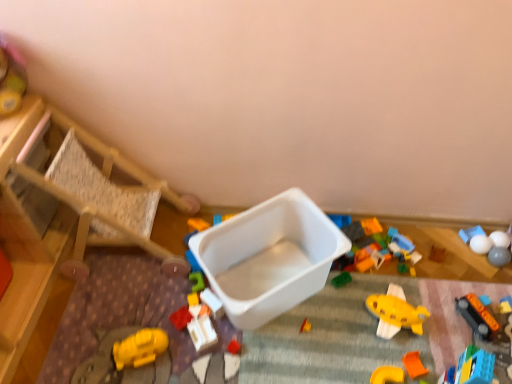
Where is `free spot in front of white glossy ball at upper right, the 11th toy in the left-to-right sequence`? free spot in front of white glossy ball at upper right, the 11th toy in the left-to-right sequence is located at coordinates (480, 297).